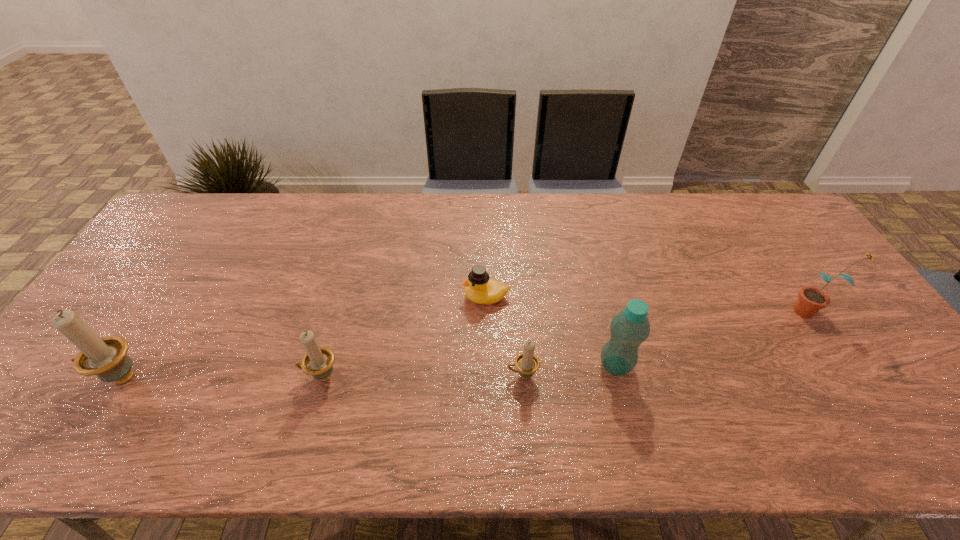
Where is `the tallest candle_holder`? Image resolution: width=960 pixels, height=540 pixels. the tallest candle_holder is located at coordinates (106, 357).

This screenshot has height=540, width=960. I want to click on the leftmost object, so click(x=106, y=357).

You are a GUI agent. You are given a task and a screenshot of the screen. Output one action in this format:
    pyautogui.click(x=<x>, y=<y>)
    Task: Click on the second object from left to right
    This screenshot has height=540, width=960.
    Given the screenshot: What is the action you would take?
    pyautogui.click(x=318, y=361)

Where is `the third shortest object`? The height and width of the screenshot is (540, 960). the third shortest object is located at coordinates click(x=318, y=361).

Locate an element on the screen. The image size is (960, 540). the second shortest object is located at coordinates (527, 363).

Locate an element on the screen. The width and height of the screenshot is (960, 540). the rightmost candle_holder is located at coordinates (527, 363).

This screenshot has height=540, width=960. I want to click on sunflower, so click(811, 299).

Locate an element on the screen. This screenshot has width=960, height=540. water bottle is located at coordinates (630, 328).

Where is `the shortest object`? This screenshot has width=960, height=540. the shortest object is located at coordinates coord(480,289).

You are a GUI agent. You are given a task and a screenshot of the screen. Output one action in this format:
    pyautogui.click(x=<x>, y=<y>)
    Task: Click on the free region located 0.090m on the handle side of the tallest candle_holder
    The image size is (960, 540).
    Given the screenshot: What is the action you would take?
    pyautogui.click(x=55, y=377)